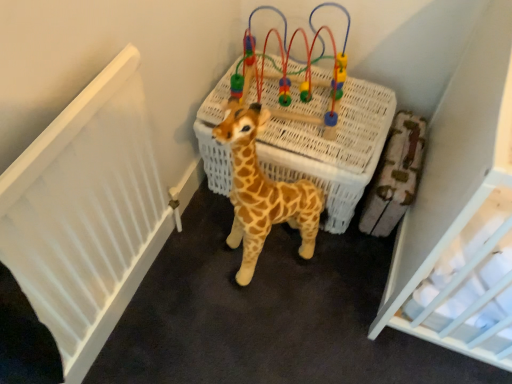
Question: From a real-world perspective, is spotted plush giraffe at center above or below wooden bead maze at center?

Choices:
 (A) below
 (B) above

Answer: (A)

Question: Is point (273, 218) closer or farther from the camera than point (248, 86)?

Choices:
 (A) closer
 (B) farther

Answer: (B)

Question: Estimate the real-world distances between objects in this image. Which object is farther from the white wicker basket at center?

Choices:
 (A) spotted plush giraffe at center
 (B) wooden bead maze at center

Answer: (A)

Question: Which is farther from the white wicker basket at center?

Choices:
 (A) spotted plush giraffe at center
 (B) wooden bead maze at center

Answer: (A)